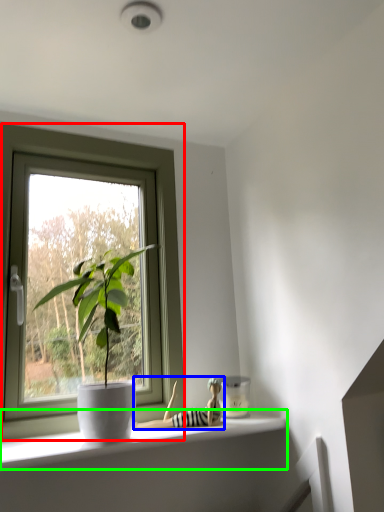
Question: Considering the real-world distances, which object is farthest from window (highlighted by a red box)? toy (highlighted by a blue box) or window sill (highlighted by a green box)?

Choices:
 (A) toy
 (B) window sill

Answer: (A)